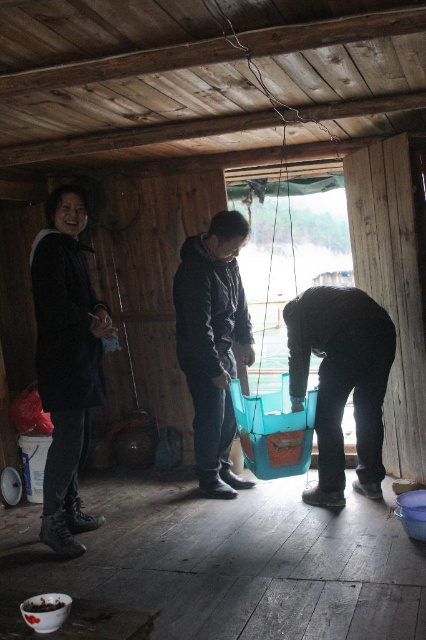
Can you confirm if matte black jacket at left is positioned below brown matte bowl at lower left?

No.

Is point (72, 218) closer to viewer compared to point (48, 593)?

No.

Where is `matte black jacket at left`? Image resolution: width=426 pixels, height=640 pixels. matte black jacket at left is located at coordinates (66, 362).

The image size is (426, 640). What do you see at coordinates (342, 381) in the screenshot?
I see `blue plastic bucket at lower right` at bounding box center [342, 381].

Is point (348, 298) closer to camera compared to point (51, 595)?

No, it is not.

Image resolution: width=426 pixels, height=640 pixels. In order to click on blue plastic bucket at lower right in this screenshot , I will do `click(342, 381)`.

Is black matte jacket at center smaller than brown matte bowl at lower left?

No, black matte jacket at center is not smaller than brown matte bowl at lower left.

Find the location of a particular element. The image size is (426, 640). black matte jacket at center is located at coordinates (213, 342).